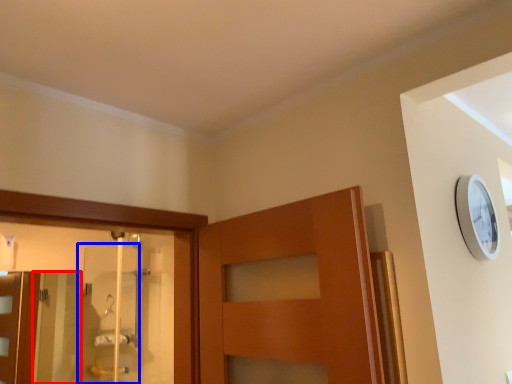
Question: Which point is closer to the camera, screen door (highlighted by a red box) or screen door (highlighted by a blue box)?

Choices:
 (A) screen door
 (B) screen door

Answer: (B)